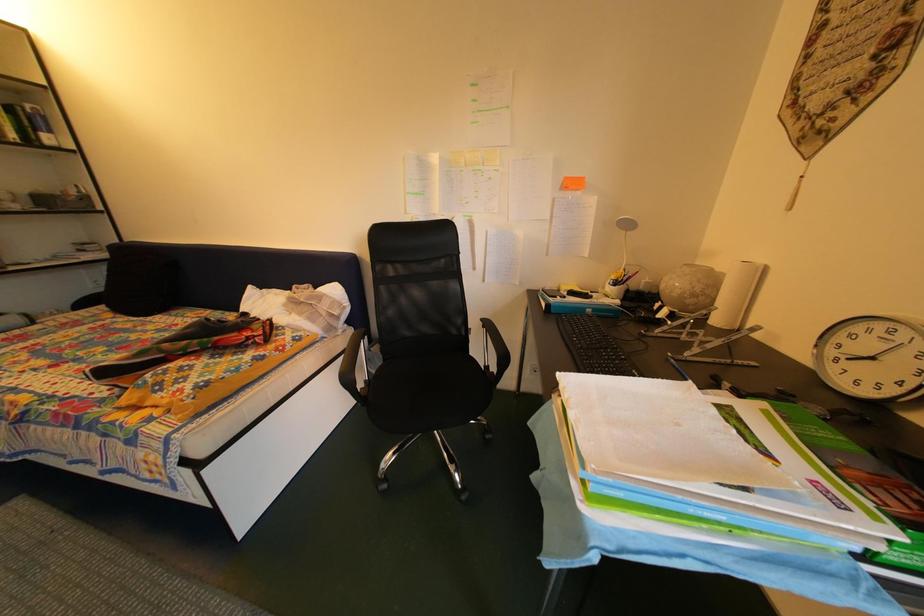
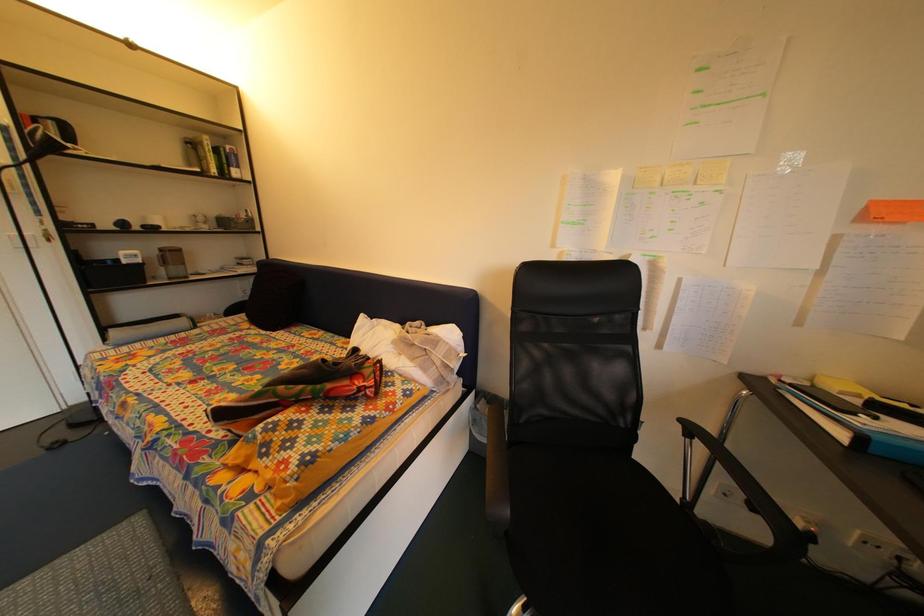
Question: The images are taken continuously from a first-person perspective. In which direction is your viewpoint rotating?

Choices:
 (A) Left
 (B) Right
 (C) Up
 (D) Down

Answer: (A)